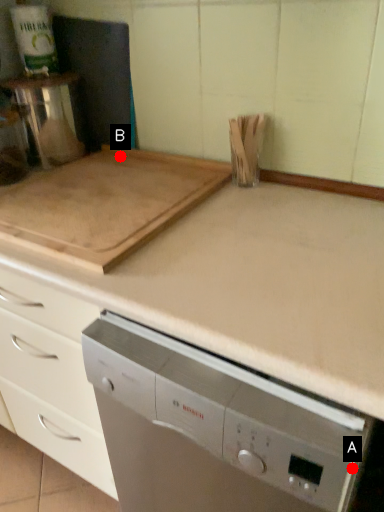
Question: Two points are circled on the image, labeled by A and B beside each circle. Which point is closer to the camera?

Choices:
 (A) A is closer
 (B) B is closer

Answer: (A)